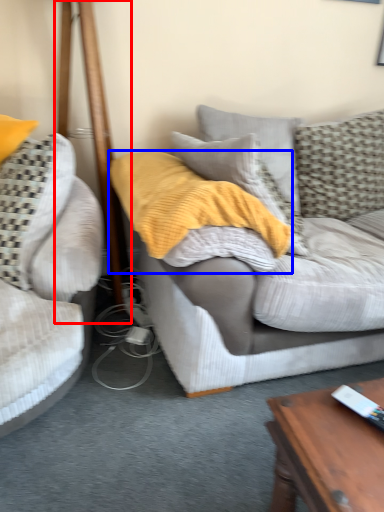
Question: Which object is further to the camera taking this photo, pole (highlighted by a red box) or blanket (highlighted by a blue box)?

Choices:
 (A) pole
 (B) blanket

Answer: (A)